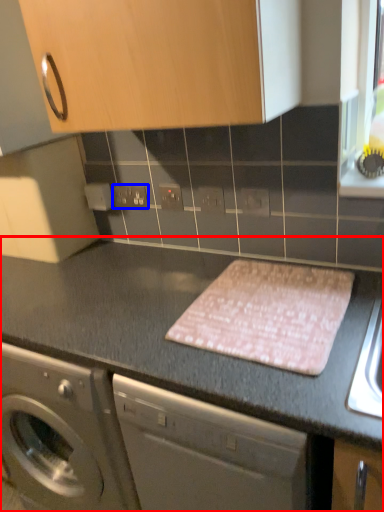
Question: Which point is further to the camera, countertop (highlighted by a red box) or electric outlet (highlighted by a blue box)?

Choices:
 (A) countertop
 (B) electric outlet

Answer: (B)